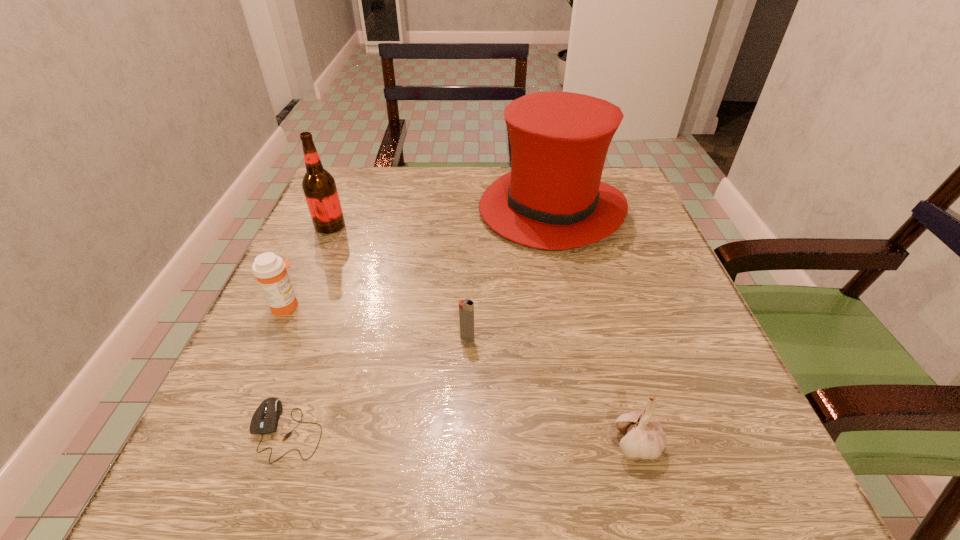
Where is `hat`? The image size is (960, 540). hat is located at coordinates (553, 198).

Locate an element on the screen. This screenshot has width=960, height=540. root beer is located at coordinates (319, 187).

The image size is (960, 540). Identify the location of medicine. (270, 270).

You are a GUI agent. You are given a task and a screenshot of the screen. Output one action in this format:
    pyautogui.click(x=<x>, y=<y>)
    Task: Click on the fourth nearest object
    This screenshot has height=540, width=960.
    Given the screenshot: What is the action you would take?
    pyautogui.click(x=270, y=270)

Locate an element on the screen. igniter is located at coordinates (466, 307).

Locate an element on the screen. This screenshot has width=960, height=540. the third nearest object is located at coordinates (466, 307).

In order to click on garlic in this screenshot , I will do `click(644, 438)`.

Locate an element on the screen. Image resolution: width=960 pixels, height=540 pixels. computer mouse is located at coordinates (265, 419).

The width and height of the screenshot is (960, 540). What are the coordinates of `vacant point located 0.080m on the left of the hat` in the screenshot? It's located at coord(445,209).

The height and width of the screenshot is (540, 960). I want to click on free space located on the front of the root beer, so click(306, 281).